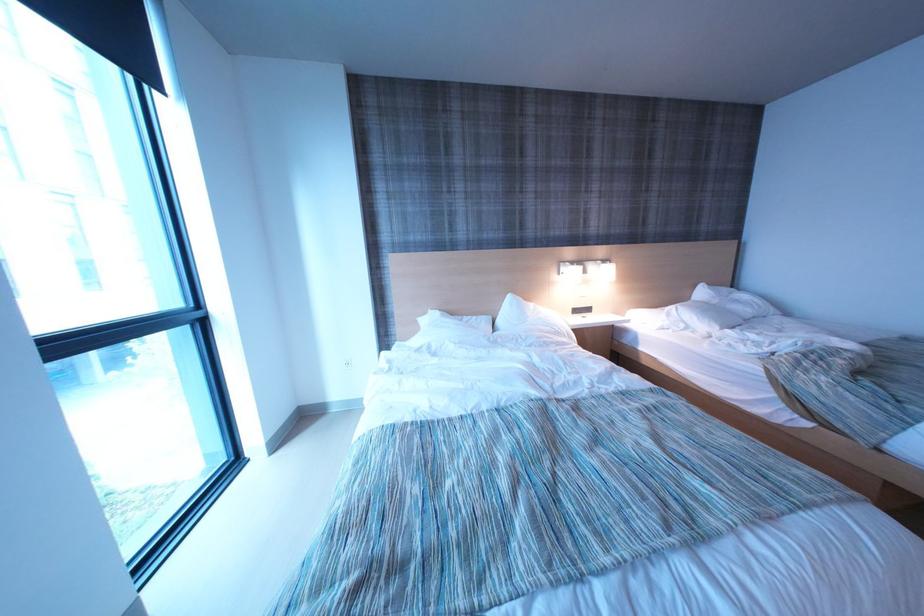
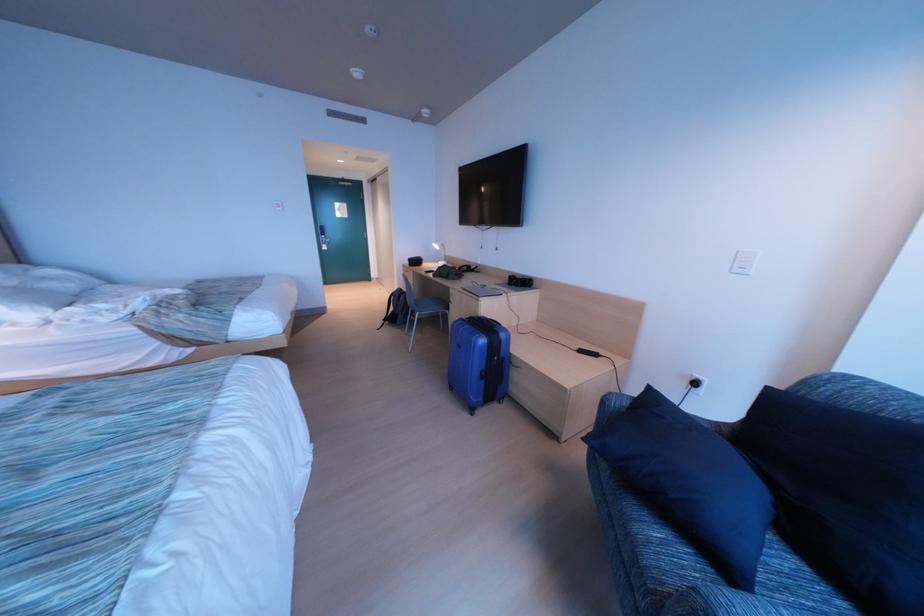
First-person continuous shooting, in which direction is the camera rotating?

The camera rotated toward right-down.